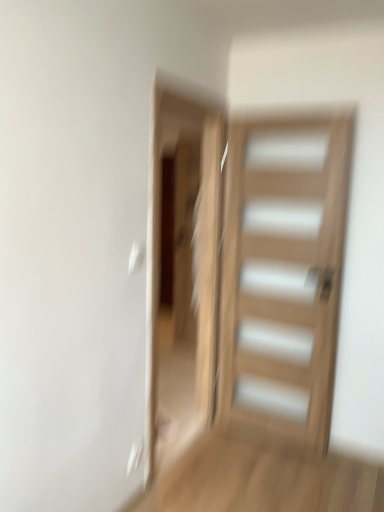
Question: Is natural wood door at center taller than transparent glass screen door at center?

Choices:
 (A) yes
 (B) no

Answer: (B)

Question: Is natural wood door at center further to the viewer compared to transparent glass screen door at center?

Choices:
 (A) no
 (B) yes

Answer: (B)

Question: Can you confirm if natural wood door at center is wider than transparent glass screen door at center?

Choices:
 (A) no
 (B) yes

Answer: (A)

Question: Is the position of natural wood door at center less distant than that of transparent glass screen door at center?

Choices:
 (A) no
 (B) yes

Answer: (A)

Question: Is natural wood door at center placed right next to transparent glass screen door at center?

Choices:
 (A) yes
 (B) no

Answer: (B)

Question: From a real-world perspective, does natural wood door at center sit lower than transparent glass screen door at center?

Choices:
 (A) yes
 (B) no

Answer: (A)

Question: Is transparent glass screen door at center closer to the viewer compared to natural wood door at center?

Choices:
 (A) yes
 (B) no

Answer: (A)

Question: From the image's perspective, is transparent glass screen door at center above natural wood door at center?

Choices:
 (A) no
 (B) yes

Answer: (B)

Question: Would you say transparent glass screen door at center is outside natural wood door at center?

Choices:
 (A) yes
 (B) no

Answer: (A)

Question: Does transparent glass screen door at center have a lesser width compared to natural wood door at center?

Choices:
 (A) yes
 (B) no

Answer: (B)

Question: Is natural wood door at center completely or partially inside transparent glass screen door at center?

Choices:
 (A) no
 (B) yes

Answer: (A)

Question: Is transparent glass screen door at center wider than natural wood door at center?

Choices:
 (A) no
 (B) yes

Answer: (B)

Question: From the image's perspective, is transparent glass screen door at center located above or below natural wood door at center?

Choices:
 (A) below
 (B) above

Answer: (B)